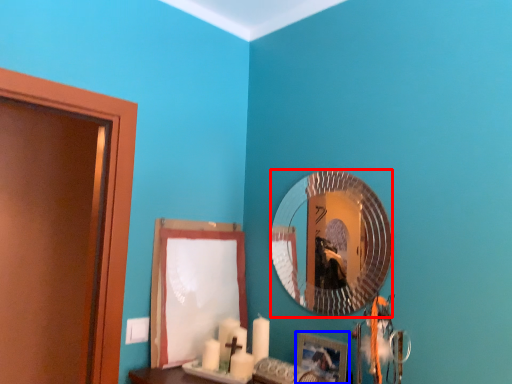
Question: Which object is closer to the camera taking this photo, mirror (highlighted by a red box) or picture frame (highlighted by a blue box)?

Choices:
 (A) mirror
 (B) picture frame

Answer: (B)